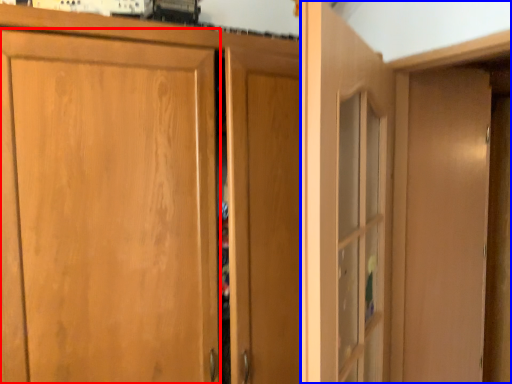
Question: Which point is closer to the camera, door (highlighted by a red box) or dresser (highlighted by a blue box)?

Choices:
 (A) door
 (B) dresser

Answer: (A)